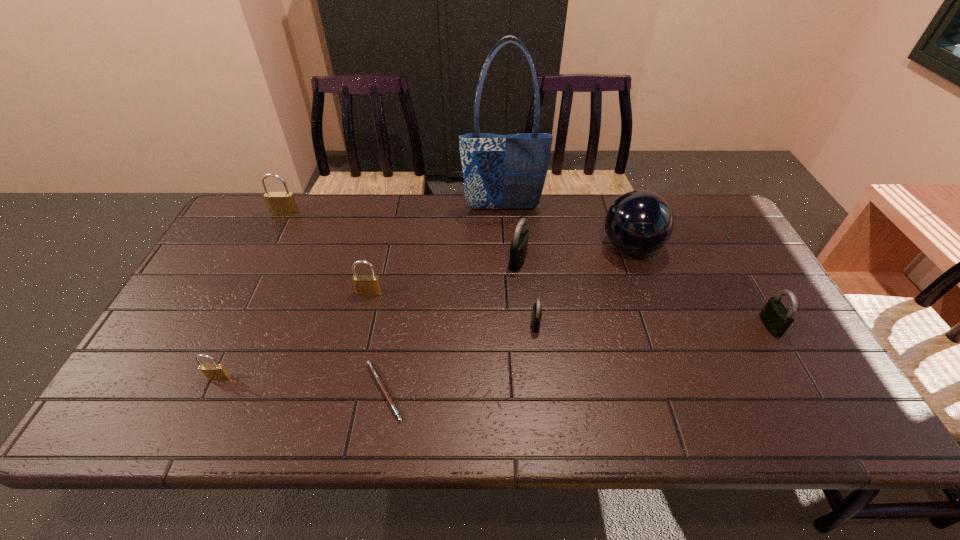
Identify which padlock is the third nearest to the nearest padlock. Please provide its 2D coordinates. Your answer should be formatted as a tuple, i.e. [(x, y)], where the tuple contains the x and y coordinates of a point satisfying the conditions above.

[(536, 312)]

Identify which padlock is the fifth closest to the second smallest black padlock. Please provide its 2D coordinates. Your answer should be formatted as a tuple, i.e. [(x, y)], where the tuple contains the x and y coordinates of a point satisfying the conditions above.

[(279, 203)]

You are a GUI agent. You are given a task and a screenshot of the screen. Output one action in this format:
    pyautogui.click(x=<x>, y=<y>)
    Task: Click on the second closest brass padlock to the smallest black padlock
    This screenshot has width=960, height=540.
    Given the screenshot: What is the action you would take?
    pyautogui.click(x=212, y=371)

The image size is (960, 540). Find the location of `brass padlock that is the second closest to the smallest black padlock`. brass padlock that is the second closest to the smallest black padlock is located at coordinates (212, 371).

Identify the location of black padlock that stands as the second closest to the biggest brass padlock. (536, 312).

Find the location of a particular element. The height and width of the screenshot is (540, 960). black padlock identified as the third closest to the shopping bag is located at coordinates (775, 317).

You are a GUI agent. You are given a task and a screenshot of the screen. Output one action in this format:
    pyautogui.click(x=<x>, y=<y>)
    Task: Click on the free location that satisfies the following two spatial constraints: 1. on the side of the bowling ball with the finger holes; 2. on the right side of the rightmost black padlock
    This screenshot has height=540, width=960.
    Given the screenshot: What is the action you would take?
    pyautogui.click(x=659, y=326)

You are a GUI agent. You are given a task and a screenshot of the screen. Output one action in this format:
    pyautogui.click(x=<x>, y=<y>)
    Task: Click on the free space that satisfies the following two spatial constraints: 1. on the front-facing side of the tallest object; 2. on the left side of the rightmost object
    This screenshot has height=540, width=960.
    Given the screenshot: What is the action you would take?
    click(510, 326)

The image size is (960, 540). In order to click on free spot that satisfies the following two spatial constraints: 1. on the front-facing side of the tallest object; 2. on the right side of the fifth nearest padlock in this screenshot , I will do `click(506, 261)`.

This screenshot has width=960, height=540. I want to click on free point that satisfies the following two spatial constraints: 1. on the front-facing side of the smallest black padlock; 2. on the left side of the shopping bag, so point(510,324).